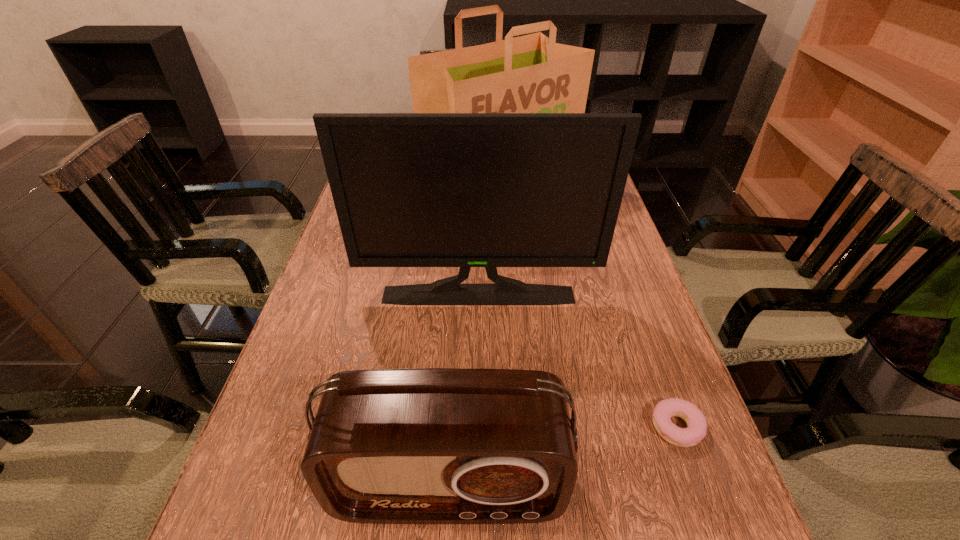
Locate an element on the screen. the farthest object is located at coordinates (527, 74).

You are a GUI agent. You are given a task and a screenshot of the screen. Output one action in this format:
    pyautogui.click(x=<x>, y=<y>)
    Task: Click on the monitor
    This screenshot has width=960, height=540.
    Given the screenshot: What is the action you would take?
    pyautogui.click(x=465, y=190)

You are a GUI agent. You are given a task and a screenshot of the screen. Output one action in this format:
    pyautogui.click(x=<x>, y=<y>)
    Task: Click on the second shortest object
    The height and width of the screenshot is (540, 960).
    Given the screenshot: What is the action you would take?
    pyautogui.click(x=433, y=445)

The width and height of the screenshot is (960, 540). Find the location of `the shortest object`. the shortest object is located at coordinates (683, 437).

Identify the location of vacant space located 0.190m on the left of the grocery bag. The width and height of the screenshot is (960, 540). (359, 188).

At what (x,y) coordinates should I click in order to perform the action: click on free region located 0.260m on the front-facing side of the monitor. Please return your answer as a coordinate pair (x, y). The width and height of the screenshot is (960, 540). Looking at the image, I should click on (477, 412).

Find the location of a particular element. The width and height of the screenshot is (960, 540). vacant space located 0.070m on the front of the doughnut is located at coordinates (700, 496).

I want to click on object that is positioned at the far edge, so click(527, 74).

Find the location of `monitor that is at the left edge`. monitor that is at the left edge is located at coordinates (465, 190).

Where is `radio receiver present at the left edge`? radio receiver present at the left edge is located at coordinates (433, 445).